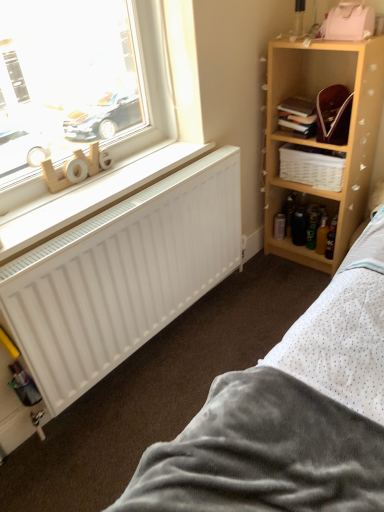
At what (x,y) coordinates should I click in order to perform the action: click on vacant area that lies in front of white matte radiator at lower left. Please return your answer as a coordinate pair (x, y). Image resolution: width=384 pixels, height=512 pixels. Looking at the image, I should click on (140, 391).